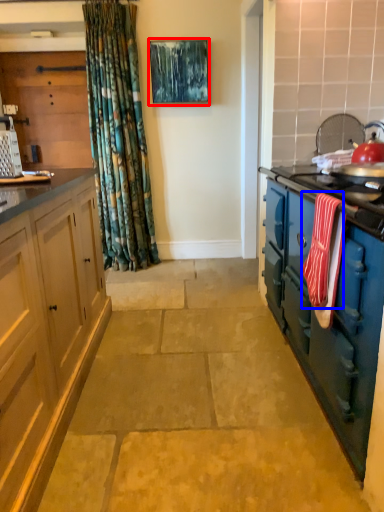
Question: Which point is further to the camera, picture frame (highlighted by a red box) or material (highlighted by a blue box)?

Choices:
 (A) picture frame
 (B) material

Answer: (A)